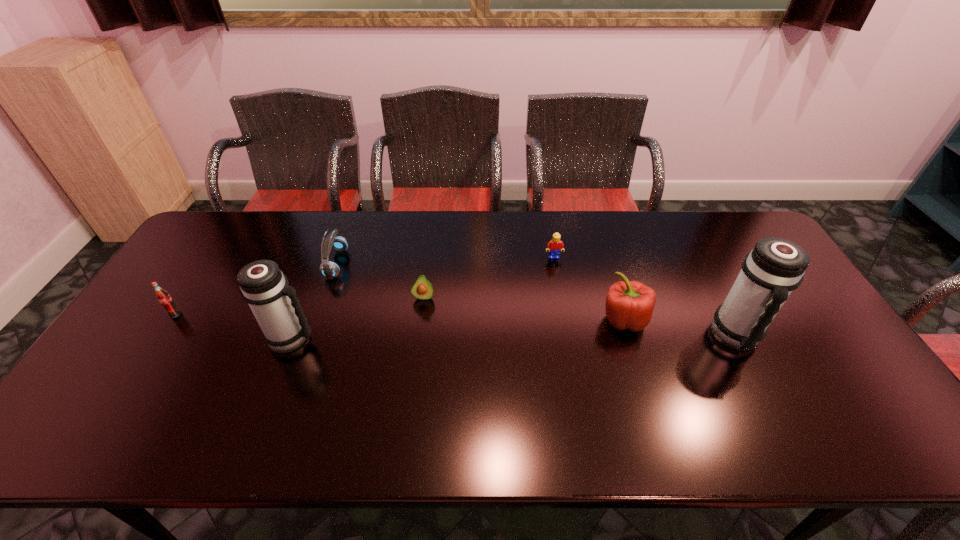
Where is `free spot at the near edge of the desktop`? This screenshot has width=960, height=540. free spot at the near edge of the desktop is located at coordinates (430, 401).

In the image, there is a desktop. At what (x,y) coordinates should I click in order to perform the action: click on vacant space at the left edge. Please return your answer as a coordinate pair (x, y). Looking at the image, I should click on (133, 360).

I want to click on vacant space at the right edge of the desktop, so click(x=791, y=363).

This screenshot has height=540, width=960. Find the location of `vacant point at the far left corner`. vacant point at the far left corner is located at coordinates (221, 213).

At what (x,y) coordinates should I click in order to perform the action: click on empty space between the soda bottle and the Lego. Please return your answer as a coordinate pair (x, y). The width and height of the screenshot is (960, 540). Looking at the image, I should click on pyautogui.click(x=365, y=286).

Find the location of a particular element. The width and height of the screenshot is (960, 540). vacant space that's between the leftmost object and the left thermos bottle is located at coordinates (233, 326).

At what (x,y) coordinates should I click in order to perform the action: click on blank region between the taller thermos bottle and the fourth object from right to left. Please return your answer as a coordinate pair (x, y). Looking at the image, I should click on (580, 316).

Identify the location of vacant space that's between the second object from right to left and the avocado. The width and height of the screenshot is (960, 540). (524, 308).

At what (x,y) coordinates should I click in order to perform the action: click on free space between the headset and the sixth object from left to right. Please return your answer as a coordinate pair (x, y). The width and height of the screenshot is (960, 540). Looking at the image, I should click on (480, 292).

At what (x,y) coordinates should I click in order to perform the action: click on free area in between the shorter thermos bottle and the soda bottle. Please return your answer as a coordinate pair (x, y). Looking at the image, I should click on (233, 326).